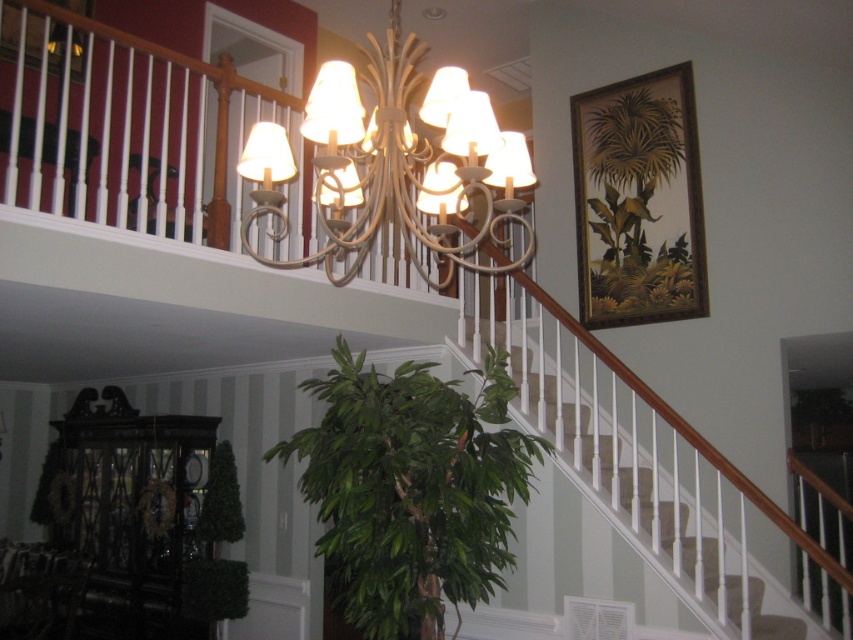
Question: Which of these objects is positioned farthest from the wooden framed painting at upper right?

Choices:
 (A) white matte chandelier at upper center
 (B) wooden picture frame at upper left
 (C) white textured stairs at center
 (D) green leafy plant at center

Answer: (B)

Question: Is green leafy plant at center further to the viewer compared to white textured stairs at center?

Choices:
 (A) no
 (B) yes

Answer: (B)

Question: Does white matte chandelier at upper center come in front of wooden picture frame at upper left?

Choices:
 (A) no
 (B) yes

Answer: (B)

Question: Which point is farther to the camera?

Choices:
 (A) (665, 76)
 (B) (352, 141)
 (C) (318, 504)

Answer: (C)

Question: Which of the following is the closest to the observer?

Choices:
 (A) white matte chandelier at upper center
 (B) wooden framed painting at upper right

Answer: (A)

Question: Considering the relative positions of green leafy plant at center and wooden picture frame at upper left in the image provided, where is green leafy plant at center located with respect to wooden picture frame at upper left?

Choices:
 (A) below
 (B) above

Answer: (A)